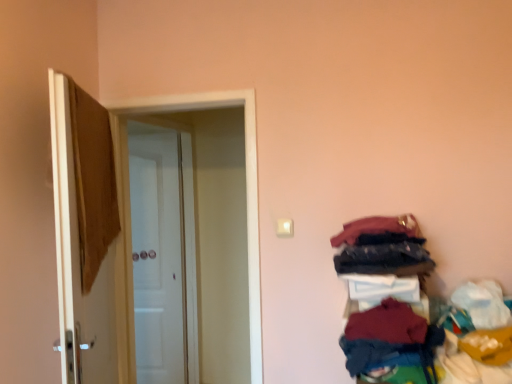
Describe the element at coordinates (85, 233) in the screenshot. I see `brown fabric at left, the third door from the back` at that location.

Where is `white glossy door at center, which is counted as the second door, starting from the back`? white glossy door at center, which is counted as the second door, starting from the back is located at coordinates (130, 232).

Measure the distance between point [351,338] and camera.

Point [351,338] is 1.38 meters from camera.

Image resolution: width=512 pixels, height=384 pixels. What do you see at coordinates (390, 339) in the screenshot?
I see `maroon fabric shirt at lower right, which ranks as the 4th clothing in top-to-bottom order` at bounding box center [390, 339].

Identify the location of dark blue fabric at right, the second clothing when ordered from top to bottom. The height and width of the screenshot is (384, 512). (384, 259).

From the image's perspective, between white glossy door at center, which is the first door from back to front, and dark blue fabric at right, the second clothing when ordered from top to bottom, who is located below?

white glossy door at center, which is the first door from back to front, is shown below in the image.

Which of these two, white glossy door at center, which is the first door from back to front, or dark blue fabric at right, the second clothing when ordered from top to bottom, is bigger?

With larger size is white glossy door at center, which is the first door from back to front.

Is white glossy door at center, which is the first door from back to front, oriented towards dark blue fabric at right, the 3th clothing when ordered from bottom to top?

No, white glossy door at center, which is the first door from back to front, is not oriented towards dark blue fabric at right, the 3th clothing when ordered from bottom to top.

Between maroon fabric shirt at lower right, which ranks as the 4th clothing in top-to-bottom order, and dark blue fabric at right, the 3th clothing when ordered from bottom to top, which one appears on the right side from the viewer's perspective?

Positioned to the right is dark blue fabric at right, the 3th clothing when ordered from bottom to top.

Which is less distant, (364, 366) or (409, 258)?

Point (364, 366) is closer to the camera than point (409, 258).

Is maroon fabric shirt at lower right, marked as the 1th clothing in a bottom-to-top arrangement, not within dark blue fabric at right, the second clothing when ordered from top to bottom?

maroon fabric shirt at lower right, marked as the 1th clothing in a bottom-to-top arrangement, is positioned outside dark blue fabric at right, the second clothing when ordered from top to bottom.

Can you confirm if maroon fabric shirt at lower right, marked as the 1th clothing in a bottom-to-top arrangement, is taller than dark blue fabric at right, the 3th clothing when ordered from bottom to top?

Correct, maroon fabric shirt at lower right, marked as the 1th clothing in a bottom-to-top arrangement, is much taller as dark blue fabric at right, the 3th clothing when ordered from bottom to top.

Is the depth of velvet-like red fabric at upper right, which is the 4th clothing in bottom-to-top order, greater than that of maroon fabric shirt at lower right, marked as the 1th clothing in a bottom-to-top arrangement?

Yes, velvet-like red fabric at upper right, which is the 4th clothing in bottom-to-top order, is behind maroon fabric shirt at lower right, marked as the 1th clothing in a bottom-to-top arrangement.

You are a GUI agent. You are given a task and a screenshot of the screen. Output one action in this format:
    pyautogui.click(x=<x>, y=<y>)
    Task: Click on the 3rd clothing above the maroon fabric shirt at lower right, marked as the 1th clothing in a bottom-to-top arrangement (from the image's perspective)
    The width and height of the screenshot is (512, 384).
    Given the screenshot: What is the action you would take?
    pyautogui.click(x=379, y=231)

Can we say velvet-like red fabric at upper right, which is the 4th clothing in bottom-to-top order, lies outside maroon fabric shirt at lower right, which ranks as the 4th clothing in top-to-bottom order?

velvet-like red fabric at upper right, which is the 4th clothing in bottom-to-top order, lies outside maroon fabric shirt at lower right, which ranks as the 4th clothing in top-to-bottom order,'s area.

Can you confirm if velvet-like red fabric at upper right, which is the 4th clothing in bottom-to-top order, is taller than maroon fabric shirt at lower right, which ranks as the 4th clothing in top-to-bottom order?

No, velvet-like red fabric at upper right, which is the 4th clothing in bottom-to-top order, is not taller than maroon fabric shirt at lower right, which ranks as the 4th clothing in top-to-bottom order.

Is dark red fabric at lower right, marked as the 3th clothing in a top-to-bottom arrangement, at the back of maroon fabric shirt at lower right, marked as the 1th clothing in a bottom-to-top arrangement?

No, maroon fabric shirt at lower right, marked as the 1th clothing in a bottom-to-top arrangement,'s orientation is not away from dark red fabric at lower right, marked as the 3th clothing in a top-to-bottom arrangement.

Is maroon fabric shirt at lower right, which ranks as the 4th clothing in top-to-bottom order, next to dark red fabric at lower right, marked as the 3th clothing in a top-to-bottom arrangement?

Yes, maroon fabric shirt at lower right, which ranks as the 4th clothing in top-to-bottom order, is in contact with dark red fabric at lower right, marked as the 3th clothing in a top-to-bottom arrangement.

Is maroon fabric shirt at lower right, marked as the 1th clothing in a bottom-to-top arrangement, closer to the viewer compared to dark red fabric at lower right, marked as the 3th clothing in a top-to-bottom arrangement?

Yes.

Between maroon fabric shirt at lower right, marked as the 1th clothing in a bottom-to-top arrangement, and dark red fabric at lower right, acting as the second clothing starting from the bottom, which one has smaller width?

With smaller width is dark red fabric at lower right, acting as the second clothing starting from the bottom.

Is maroon fabric shirt at lower right, which ranks as the 4th clothing in top-to-bottom order, spatially inside velvet-like red fabric at upper right, which is the 4th clothing in bottom-to-top order, or outside of it?

maroon fabric shirt at lower right, which ranks as the 4th clothing in top-to-bottom order, exists outside the volume of velvet-like red fabric at upper right, which is the 4th clothing in bottom-to-top order.

Is maroon fabric shirt at lower right, marked as the 1th clothing in a bottom-to-top arrangement, facing away from velvet-like red fabric at upper right, which is the 4th clothing in bottom-to-top order?

That's not correct — maroon fabric shirt at lower right, marked as the 1th clothing in a bottom-to-top arrangement, is not looking away from velvet-like red fabric at upper right, which is the 4th clothing in bottom-to-top order.

From a real-world perspective, is maroon fabric shirt at lower right, marked as the 1th clothing in a bottom-to-top arrangement, physically above velvet-like red fabric at upper right, which is the 4th clothing in bottom-to-top order?

No.

Would you say velvet-like red fabric at upper right, marked as the 1th clothing in a top-to-bottom arrangement, contains dark blue fabric at right, the second clothing when ordered from top to bottom?

Indeed, dark blue fabric at right, the second clothing when ordered from top to bottom, is located within velvet-like red fabric at upper right, marked as the 1th clothing in a top-to-bottom arrangement.

Considering the relative positions of velvet-like red fabric at upper right, marked as the 1th clothing in a top-to-bottom arrangement, and dark blue fabric at right, the second clothing when ordered from top to bottom, in the image provided, is velvet-like red fabric at upper right, marked as the 1th clothing in a top-to-bottom arrangement, to the right of dark blue fabric at right, the second clothing when ordered from top to bottom, from the viewer's perspective?

Correct, you'll find velvet-like red fabric at upper right, marked as the 1th clothing in a top-to-bottom arrangement, to the right of dark blue fabric at right, the second clothing when ordered from top to bottom.

Is velvet-like red fabric at upper right, which is the 4th clothing in bottom-to-top order, oriented away from dark blue fabric at right, the second clothing when ordered from top to bottom?

velvet-like red fabric at upper right, which is the 4th clothing in bottom-to-top order, does not have its back to dark blue fabric at right, the second clothing when ordered from top to bottom.

Which is further, (407, 307) or (402, 218)?

Positioned behind is point (402, 218).

How many degrees apart are the facing directions of dark red fabric at lower right, marked as the 3th clothing in a top-to-bottom arrangement, and velvet-like red fabric at upper right, which is the 4th clothing in bottom-to-top order?

There is a 11.7-degree angle between the facing directions of dark red fabric at lower right, marked as the 3th clothing in a top-to-bottom arrangement, and velvet-like red fabric at upper right, which is the 4th clothing in bottom-to-top order.

Which is behind, dark red fabric at lower right, marked as the 3th clothing in a top-to-bottom arrangement, or velvet-like red fabric at upper right, which is the 4th clothing in bottom-to-top order?

velvet-like red fabric at upper right, which is the 4th clothing in bottom-to-top order, is more distant.

From a real-world perspective, relative to velvet-like red fabric at upper right, marked as the 1th clothing in a top-to-bottom arrangement, is dark red fabric at lower right, marked as the 3th clothing in a top-to-bottom arrangement, vertically above or below?

In terms of real-world spatial position, dark red fabric at lower right, marked as the 3th clothing in a top-to-bottom arrangement, is below velvet-like red fabric at upper right, marked as the 1th clothing in a top-to-bottom arrangement.

From the image's perspective, starting from the white glossy door at center, the 3th door positioned from the front, which clothing is the 3rd one above? Please provide its 2D coordinates.

[(384, 259)]

The width and height of the screenshot is (512, 384). What are the coordinates of `the 2nd clothing positioned above the maroon fabric shirt at lower right, which ranks as the 4th clothing in top-to-bottom order (from a real-world perspective)` in the screenshot? It's located at (384, 259).

When comparing their distances from white glossy door at center, which is counted as the second door, starting from the back, does dark red fabric at lower right, acting as the second clothing starting from the bottom, or brown fabric at left, the first door positioned from the front, seem closer?

Based on the image, brown fabric at left, the first door positioned from the front, appears to be nearer to white glossy door at center, which is counted as the second door, starting from the back.

When comparing their distances from velvet-like red fabric at upper right, which is the 4th clothing in bottom-to-top order, does maroon fabric shirt at lower right, marked as the 1th clothing in a bottom-to-top arrangement, or dark red fabric at lower right, acting as the second clothing starting from the bottom, seem further?

Based on the image, maroon fabric shirt at lower right, marked as the 1th clothing in a bottom-to-top arrangement, appears to be further to velvet-like red fabric at upper right, which is the 4th clothing in bottom-to-top order.

Looking at the image, which one is located closer to velvet-like red fabric at upper right, marked as the 1th clothing in a top-to-bottom arrangement, white glossy door at center, which is the first door from back to front, or brown fabric at left, the third door from the back?

brown fabric at left, the third door from the back, lies closer to velvet-like red fabric at upper right, marked as the 1th clothing in a top-to-bottom arrangement, than the other object.

Looking at the image, which one is located closer to white glossy door at center, the 2th door positioned from the front, white glossy door at center, the 3th door positioned from the front, or dark blue fabric at right, the 3th clothing when ordered from bottom to top?

dark blue fabric at right, the 3th clothing when ordered from bottom to top, lies closer to white glossy door at center, the 2th door positioned from the front, than the other object.

Looking at the image, which one is located closer to velvet-like red fabric at upper right, marked as the 1th clothing in a top-to-bottom arrangement, dark blue fabric at right, the 3th clothing when ordered from bottom to top, or white glossy door at center, which is the first door from back to front?

dark blue fabric at right, the 3th clothing when ordered from bottom to top, is closer to velvet-like red fabric at upper right, marked as the 1th clothing in a top-to-bottom arrangement.

Considering their positions, is white glossy door at center, which is the first door from back to front, positioned closer to maroon fabric shirt at lower right, marked as the 1th clothing in a bottom-to-top arrangement, than dark red fabric at lower right, marked as the 3th clothing in a top-to-bottom arrangement?

Among the two, dark red fabric at lower right, marked as the 3th clothing in a top-to-bottom arrangement, is located nearer to maroon fabric shirt at lower right, marked as the 1th clothing in a bottom-to-top arrangement.

Based on their spatial positions, is white glossy door at center, which is counted as the second door, starting from the back, or velvet-like red fabric at upper right, marked as the 1th clothing in a top-to-bottom arrangement, further from dark red fabric at lower right, acting as the second clothing starting from the bottom?

The object further to dark red fabric at lower right, acting as the second clothing starting from the bottom, is white glossy door at center, which is counted as the second door, starting from the back.

When comparing their distances from dark red fabric at lower right, marked as the 3th clothing in a top-to-bottom arrangement, does maroon fabric shirt at lower right, which ranks as the 4th clothing in top-to-bottom order, or brown fabric at left, the third door from the back, seem further?

brown fabric at left, the third door from the back.

In order to click on clothing that lies between velvet-like red fabric at upper right, marked as the 1th clothing in a top-to-bottom arrangement, and dark red fabric at lower right, acting as the second clothing starting from the bottom, from top to bottom in this screenshot , I will do `click(384, 259)`.

This screenshot has width=512, height=384. Find the location of `door located between brown fabric at left, the first door positioned from the front, and dark blue fabric at right, the 3th clothing when ordered from bottom to top, in the left-right direction`. door located between brown fabric at left, the first door positioned from the front, and dark blue fabric at right, the 3th clothing when ordered from bottom to top, in the left-right direction is located at coordinates (130, 232).

The width and height of the screenshot is (512, 384). I want to click on door between brown fabric at left, the third door from the back, and maroon fabric shirt at lower right, which ranks as the 4th clothing in top-to-bottom order, in the horizontal direction, so click(130, 232).

Identify the location of clothing situated between white glossy door at center, which is counted as the second door, starting from the back, and maroon fabric shirt at lower right, marked as the 1th clothing in a bottom-to-top arrangement, from left to right. (387, 324).